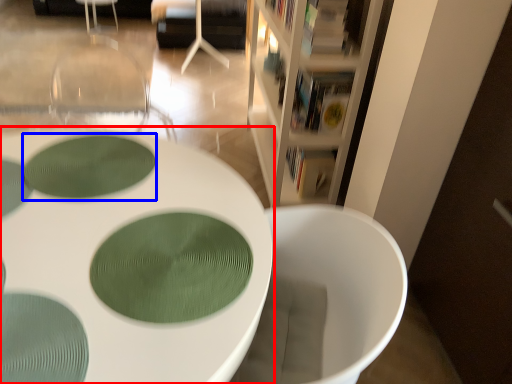
Question: Which object is further to the camera taking this photo, table (highlighted by a red box) or oval (highlighted by a blue box)?

Choices:
 (A) table
 (B) oval

Answer: (B)